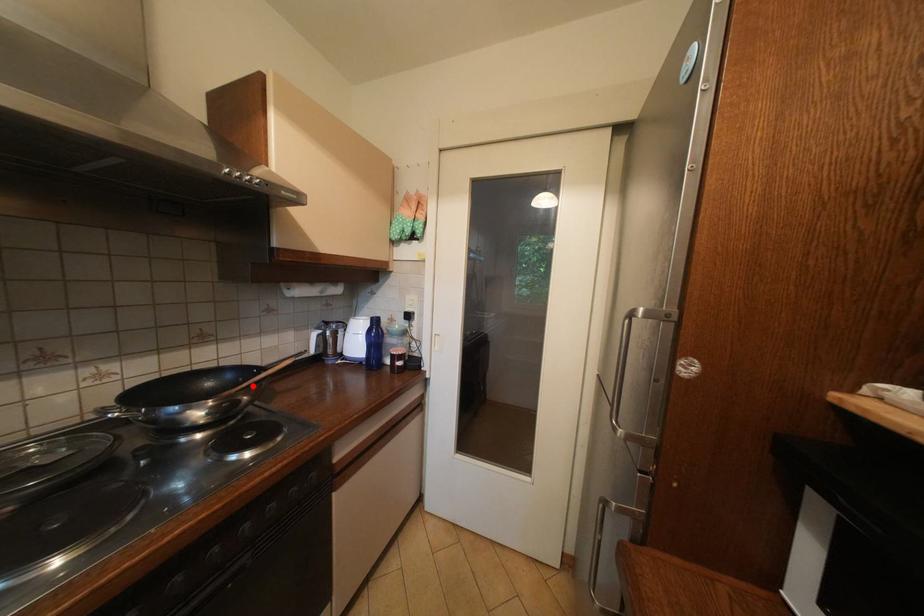
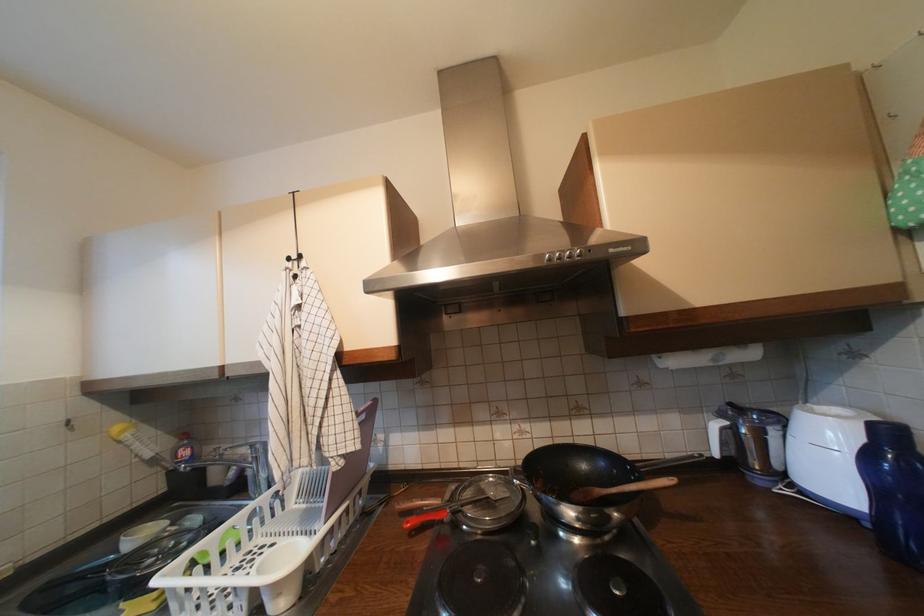
Find the pixel in the second image that matches the highlighted location in the first image.

(623, 492)